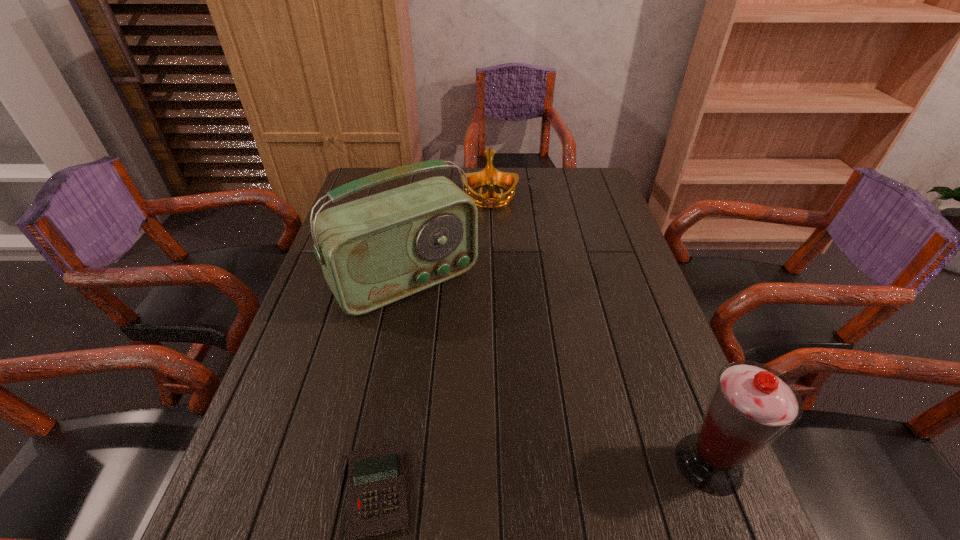
The width and height of the screenshot is (960, 540). Find the location of `free space on the desktop that is between the calculator and the smoothie and is positioned on the front panel of the radio receiver`. free space on the desktop that is between the calculator and the smoothie and is positioned on the front panel of the radio receiver is located at coordinates (552, 476).

You are a GUI agent. You are given a task and a screenshot of the screen. Output one action in this format:
    pyautogui.click(x=<x>, y=<y>)
    Task: Click on the free space on the desktop that is between the calculator and the rightmost object and is positioned at the front emblem of the third tallest object
    The image size is (960, 540).
    Given the screenshot: What is the action you would take?
    point(502,481)